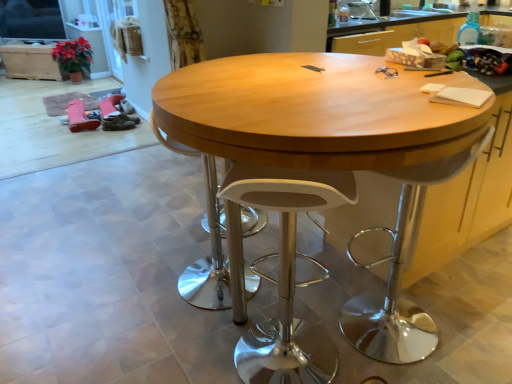
Locate an element on the screen. free region on the left part of wooden table at center is located at coordinates (95, 306).